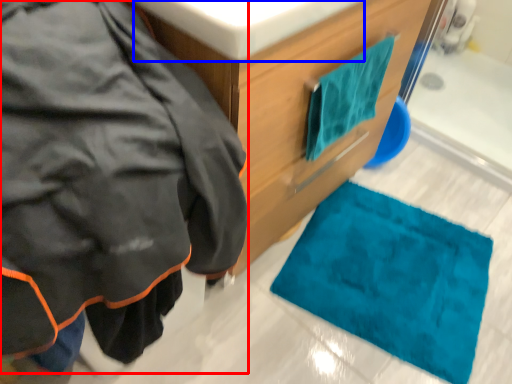
Question: Which of the following is the closest to the observer, jacket (highlighted by a red box) or sink (highlighted by a blue box)?

Choices:
 (A) jacket
 (B) sink

Answer: (A)